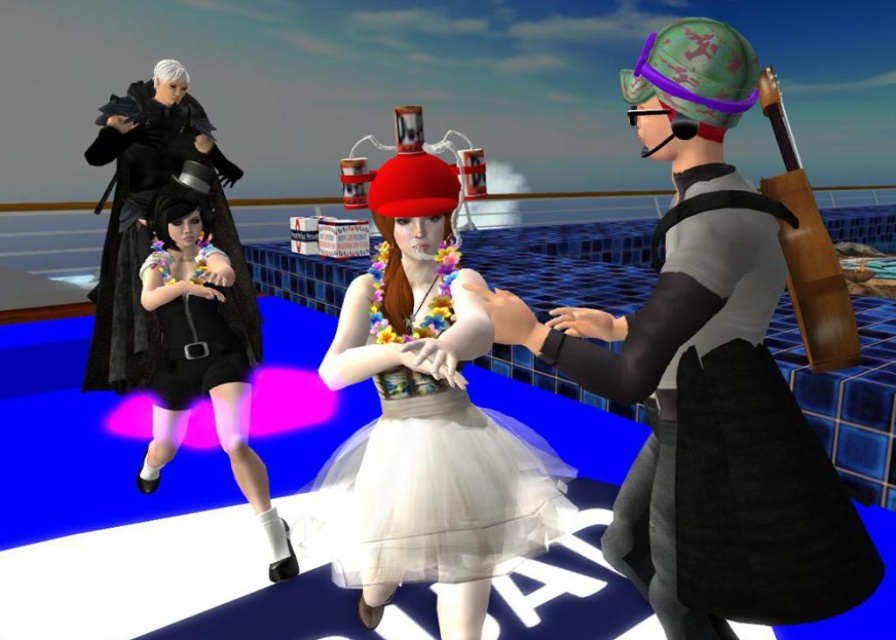
Can you confirm if matte black dress at right is shorter than black satin dress at left?

Correct, matte black dress at right is not as tall as black satin dress at left.

Who is positioned more to the right, matte black dress at right or black satin dress at left?

matte black dress at right is more to the right.

Is point (696, 333) in front of point (260, 484)?

Yes, point (696, 333) is in front of point (260, 484).

I want to click on matte black dress at right, so click(721, 433).

How far apart are black matte dress at left and black satin dress at lower left?

The distance of black matte dress at left from black satin dress at lower left is 96.04 centimeters.

Between point (141, 209) and point (222, 291), which one is positioned behind?

The point (141, 209) is behind.

Between point (121, 209) and point (179, 339), which one is positioned behind?

Point (121, 209)

Find the location of a particular element. Image resolution: width=896 pixels, height=640 pixels. black matte dress at left is located at coordinates (149, 230).

Locate an element on the screen. white tulle dress at center is located at coordinates (433, 488).

Consider the image. Is white tulle dress at center taller than black satin dress at left?

In fact, white tulle dress at center may be shorter than black satin dress at left.

Identify the location of white tulle dress at center. The image size is (896, 640). (433, 488).